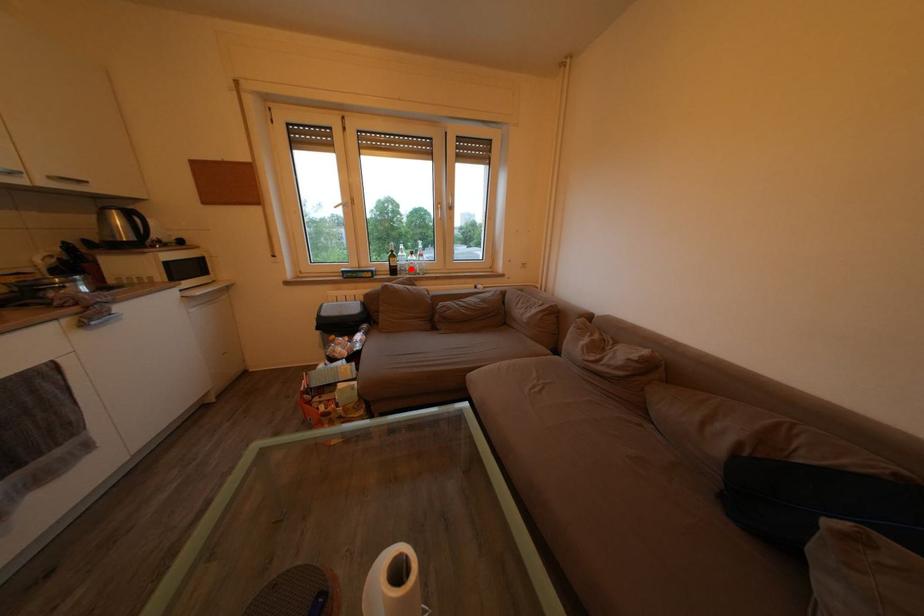
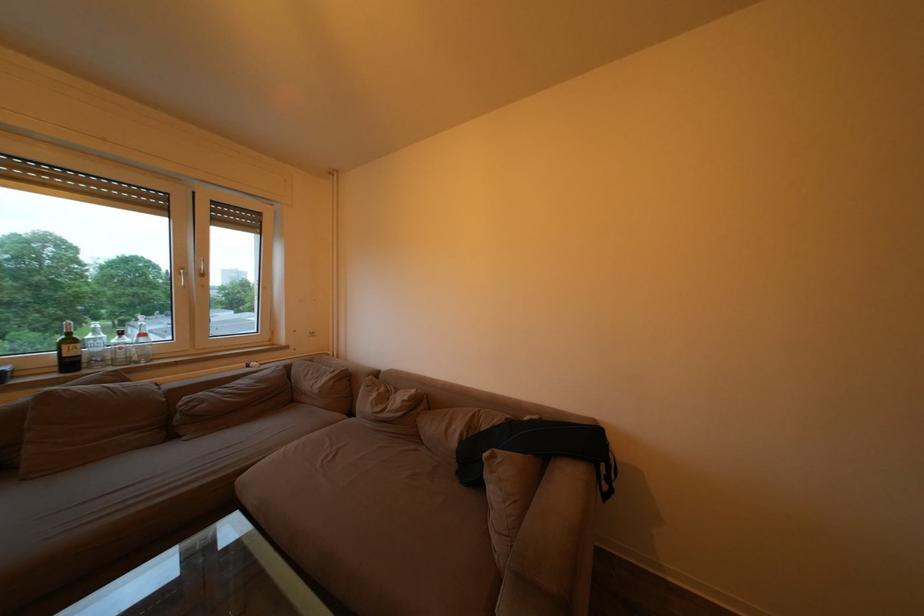
Where in the second image is the point corresponding to the highlighted location from the first image?

(107, 355)